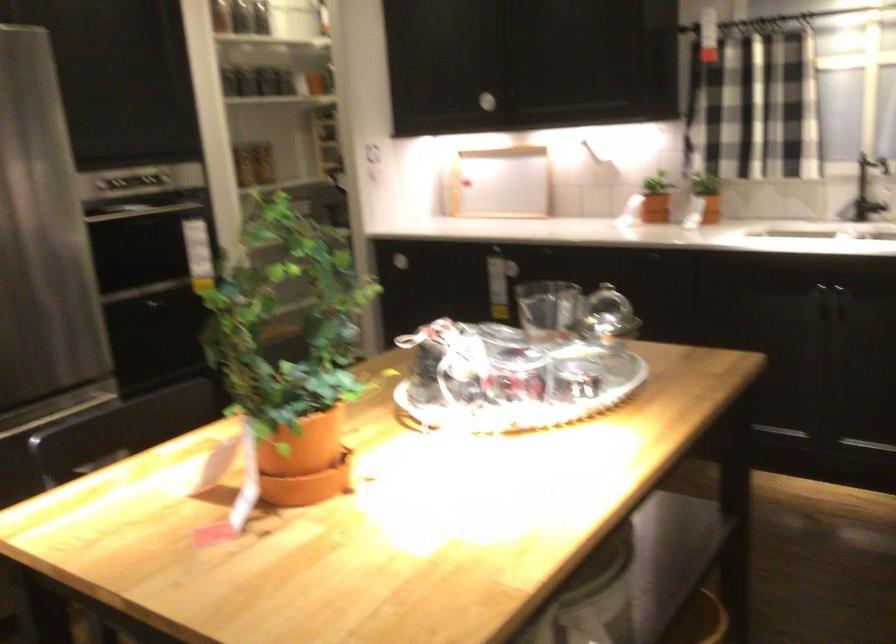
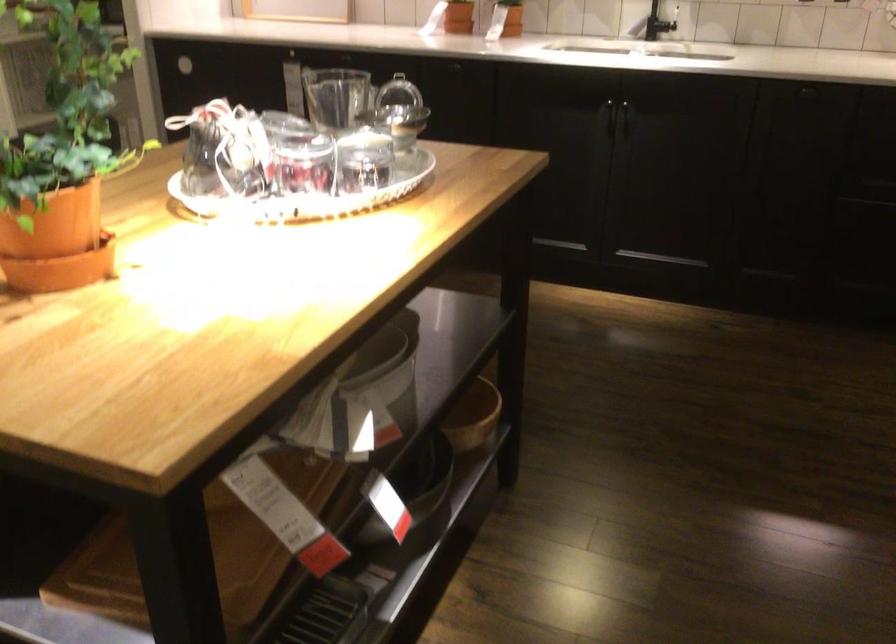
Where in the second image is the point corresponding to pixel 524 409 from the first image?

(309, 198)